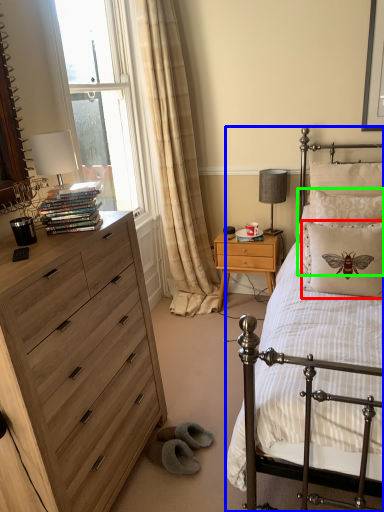
Question: Which object is the farthest from pillow (highlighted by a red box)? Choose among these: bed (highlighted by a blue box) or pillow (highlighted by a green box).

Choices:
 (A) bed
 (B) pillow

Answer: (A)